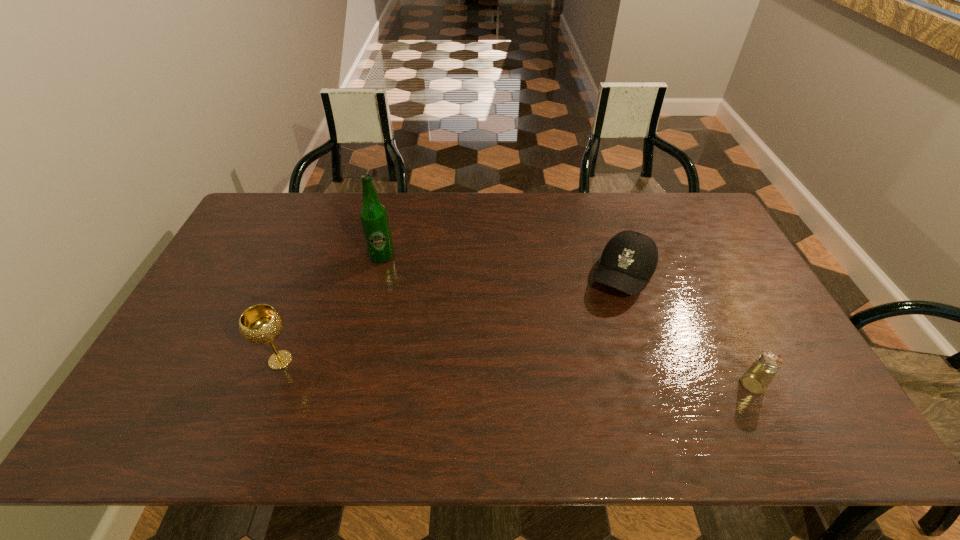
Where is `vacant space on the desktop that is between the leftmost object and the rightmost object and is positioned on the label of the tallest object`? The width and height of the screenshot is (960, 540). vacant space on the desktop that is between the leftmost object and the rightmost object and is positioned on the label of the tallest object is located at coordinates (553, 374).

Locate an element on the screen. The height and width of the screenshot is (540, 960). free space on the desktop that is between the chalice and the saltshaker and is positioned on the front-facing side of the third object from left to right is located at coordinates (570, 375).